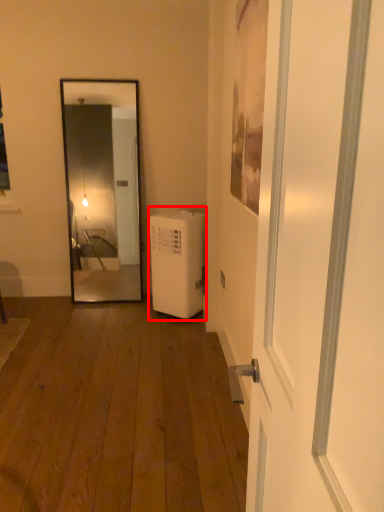
Question: From the image's perspective, considering the relative positions of dish washer (annotated by the red box) and door in the image provided, where is dish washer (annotated by the red box) located with respect to the staircase?

Choices:
 (A) above
 (B) below

Answer: (A)